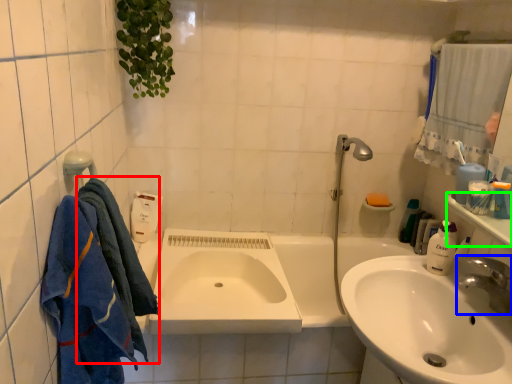
Question: Based on their relative distances, which object is nearer to bath towel (highlighted by a red box)? Choose from tap (highlighted by a blue box) and counter top (highlighted by a green box).

Choices:
 (A) tap
 (B) counter top

Answer: (A)